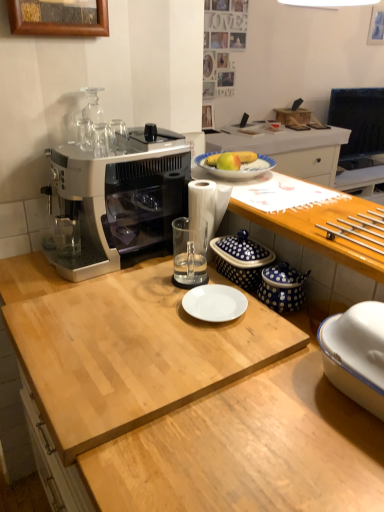
The height and width of the screenshot is (512, 384). What do you see at coordinates (58, 18) in the screenshot? I see `wooden picture frame at upper left` at bounding box center [58, 18].

Image resolution: width=384 pixels, height=512 pixels. What do you see at coordinates (241, 259) in the screenshot?
I see `blue polka dot ceramic container at center, arranged as the 2th appliance when viewed from the front` at bounding box center [241, 259].

What is the approximate width of satin silver coffee maker at left?

satin silver coffee maker at left is 18.54 inches in width.

I want to click on satin silver coffee maker at left, so click(118, 200).

Locate an element on the screen. This screenshot has width=384, height=512. wooden picture frame at upper left is located at coordinates (58, 18).

Between blue polka dot ceramic container at center, arranged as the 2th appliance when viewed from the front, and blue dotted ceramic jars at right, positioned as the 2th appliance in back-to-front order, which one has smaller size?

Smaller between the two is blue dotted ceramic jars at right, positioned as the 2th appliance in back-to-front order.

Who is taller, blue polka dot ceramic container at center, positioned as the first appliance in back-to-front order, or blue dotted ceramic jars at right, positioned as the 2th appliance in back-to-front order?

Standing taller between the two is blue polka dot ceramic container at center, positioned as the first appliance in back-to-front order.

Is blue polka dot ceramic container at center, arranged as the 2th appliance when viewed from the front, looking in the opposite direction of blue dotted ceramic jars at right, which appears as the first appliance when viewed from the front?

blue polka dot ceramic container at center, arranged as the 2th appliance when viewed from the front, is not turned away from blue dotted ceramic jars at right, which appears as the first appliance when viewed from the front.

Is blue polka dot ceramic container at center, arranged as the 2th appliance when viewed from the front, to the right of blue dotted ceramic jars at right, positioned as the 2th appliance in back-to-front order, from the viewer's perspective?

No, blue polka dot ceramic container at center, arranged as the 2th appliance when viewed from the front, is not to the right of blue dotted ceramic jars at right, positioned as the 2th appliance in back-to-front order.

Considering the sizes of objects light wood cutting board at center, which ranks as the second desk in top-to-bottom order, and satin silver coffee maker at left in the image provided, who is wider, light wood cutting board at center, which ranks as the second desk in top-to-bottom order, or satin silver coffee maker at left?

With larger width is light wood cutting board at center, which ranks as the second desk in top-to-bottom order.

From the image's perspective, is light wood cutting board at center, which is counted as the first desk, starting from the bottom, under satin silver coffee maker at left?

Yes.

From a real-world perspective, is light wood cutting board at center, which ranks as the second desk in top-to-bottom order, located higher than satin silver coffee maker at left?

Actually, light wood cutting board at center, which ranks as the second desk in top-to-bottom order, is physically below satin silver coffee maker at left in the real world.

Is the depth of light wood cutting board at center, which ranks as the second desk in top-to-bottom order, less than that of satin silver coffee maker at left?

That is True.

From a real-world perspective, is wooden picture frame at upper left over wooden at upper right, the 2th desk in the bottom-to-top sequence?

Yes, from a real-world perspective, wooden picture frame at upper left is on top of wooden at upper right, the 2th desk in the bottom-to-top sequence.

From the image's perspective, relative to wooden at upper right, the 2th desk in the bottom-to-top sequence, is wooden picture frame at upper left above or below?

wooden picture frame at upper left is situated higher than wooden at upper right, the 2th desk in the bottom-to-top sequence, in the image.

You are a GUI agent. You are given a task and a screenshot of the screen. Output one action in this format:
    pyautogui.click(x=<x>, y=<y>)
    Task: Click on the picture frame located above the wooden at upper right, the 2th desk in the bottom-to-top sequence (from a real-world perspective)
    Image resolution: width=384 pixels, height=512 pixels.
    Given the screenshot: What is the action you would take?
    pyautogui.click(x=58, y=18)

Based on the photo, is wooden picture frame at upper left positioned behind wooden at upper right, acting as the first desk starting from the top?

Yes.

Considering the sizes of objects satin silver coffee maker at left and blue polka dot ceramic container at center, arranged as the 2th appliance when viewed from the front, in the image provided, who is taller, satin silver coffee maker at left or blue polka dot ceramic container at center, arranged as the 2th appliance when viewed from the front,?

With more height is satin silver coffee maker at left.

Considering the relative positions of satin silver coffee maker at left and blue polka dot ceramic container at center, arranged as the 2th appliance when viewed from the front, in the image provided, is satin silver coffee maker at left in front of blue polka dot ceramic container at center, arranged as the 2th appliance when viewed from the front,?

Yes, it is in front of blue polka dot ceramic container at center, arranged as the 2th appliance when viewed from the front.

Would you say satin silver coffee maker at left is a long distance from blue polka dot ceramic container at center, arranged as the 2th appliance when viewed from the front?

satin silver coffee maker at left is near blue polka dot ceramic container at center, arranged as the 2th appliance when viewed from the front, not far away.

Does blue dotted ceramic jars at right, positioned as the 2th appliance in back-to-front order, have a larger size compared to blue polka dot ceramic container at center, arranged as the 2th appliance when viewed from the front?

No, blue dotted ceramic jars at right, positioned as the 2th appliance in back-to-front order, is not bigger than blue polka dot ceramic container at center, arranged as the 2th appliance when viewed from the front.

Identify the location of appliance lying on the right of blue polka dot ceramic container at center, arranged as the 2th appliance when viewed from the front. (282, 287).

Is point (267, 293) closer or farther from the camera than point (230, 260)?

Point (267, 293) is closer to the camera than point (230, 260).

Which is correct: blue dotted ceramic jars at right, positioned as the 2th appliance in back-to-front order, is inside blue polka dot ceramic container at center, positioned as the first appliance in back-to-front order, or outside of it?

blue dotted ceramic jars at right, positioned as the 2th appliance in back-to-front order, exists outside the volume of blue polka dot ceramic container at center, positioned as the first appliance in back-to-front order.

Choose the correct answer: Is blue polka dot ceramic container at center, positioned as the first appliance in back-to-front order, inside black glossy television at upper right or outside it?

The correct answer is: outside.

Considering the sizes of objects blue polka dot ceramic container at center, arranged as the 2th appliance when viewed from the front, and black glossy television at upper right in the image provided, who is smaller, blue polka dot ceramic container at center, arranged as the 2th appliance when viewed from the front, or black glossy television at upper right?

Smaller between the two is blue polka dot ceramic container at center, arranged as the 2th appliance when viewed from the front.

From the image's perspective, is blue polka dot ceramic container at center, positioned as the first appliance in back-to-front order, under black glossy television at upper right?

Yes, from the image's perspective, blue polka dot ceramic container at center, positioned as the first appliance in back-to-front order, is below black glossy television at upper right.

Considering the relative sizes of blue polka dot ceramic container at center, arranged as the 2th appliance when viewed from the front, and black glossy television at upper right in the image provided, is blue polka dot ceramic container at center, arranged as the 2th appliance when viewed from the front, taller than black glossy television at upper right?

No, blue polka dot ceramic container at center, arranged as the 2th appliance when viewed from the front, is not taller than black glossy television at upper right.

Consider the image. From a real-world perspective, who is located lower, transparent glass at center, the first tableware in the bottom-to-top sequence, or metallic silver drawer handles at right, the 2th tableware when ordered from top to bottom?

transparent glass at center, the first tableware in the bottom-to-top sequence, is physically lower.

Considering the positions of objects transparent glass at center, the 2th tableware positioned from the left, and metallic silver drawer handles at right, positioned as the third tableware in left-to-right order, in the image provided, who is more to the left, transparent glass at center, the 2th tableware positioned from the left, or metallic silver drawer handles at right, positioned as the third tableware in left-to-right order,?

Positioned to the left is transparent glass at center, the 2th tableware positioned from the left.

How different are the orientations of transparent glass at center, the 2th tableware positioned from the left, and metallic silver drawer handles at right, positioned as the third tableware in left-to-right order, in degrees?

0.486 degrees.

Are transparent glass at center, the 2th tableware positioned from the left, and metallic silver drawer handles at right, the 1th tableware in the right-to-left sequence, beside each other?

transparent glass at center, the 2th tableware positioned from the left, and metallic silver drawer handles at right, the 1th tableware in the right-to-left sequence, are not in contact.

Find the location of a particular element. appliance behind the blue dotted ceramic jars at right, which appears as the first appliance when viewed from the front is located at coordinates (241, 259).

At what (x,y) coordinates should I click in order to perform the action: click on the 2nd desk below the satin silver coffee maker at left (from the image's perspective). Please return your answer as a coordinate pair (x, y). The width and height of the screenshot is (384, 512). Looking at the image, I should click on (249, 448).

Looking at the image, which one is located further to wooden at upper right, acting as the first desk starting from the top, light wood cutting board at center, which is counted as the first desk, starting from the bottom, or yellow matte apple at center?

light wood cutting board at center, which is counted as the first desk, starting from the bottom, lies further to wooden at upper right, acting as the first desk starting from the top, than the other object.

Considering their positions, is satin silver coffee maker at left positioned further to light wood cutting board at center, which ranks as the second desk in top-to-bottom order, than blue dotted ceramic jars at right, which appears as the first appliance when viewed from the front?

satin silver coffee maker at left lies further to light wood cutting board at center, which ranks as the second desk in top-to-bottom order, than the other object.

Based on the photo, estimate the real-world distances between objects in this image. Which object is further from satin silver coffee maker at left, wooden picture frame at upper left or clear glass cups at upper left, acting as the third tableware starting from the right?

wooden picture frame at upper left is positioned further to the anchor satin silver coffee maker at left.

Considering their positions, is yellow matte apple at center positioned closer to metallic silver drawer handles at right, positioned as the third tableware in left-to-right order, than wooden picture frame at upper left?

yellow matte apple at center lies closer to metallic silver drawer handles at right, positioned as the third tableware in left-to-right order, than the other object.

Considering their positions, is metallic silver drawer handles at right, which appears as the second tableware when ordered from the bottom, positioned further to blue dotted ceramic jars at right, positioned as the 2th appliance in back-to-front order, than light wood cutting board at center, which ranks as the second desk in top-to-bottom order?

light wood cutting board at center, which ranks as the second desk in top-to-bottom order, is further to blue dotted ceramic jars at right, positioned as the 2th appliance in back-to-front order.

Looking at the image, which one is located closer to transparent glass at center, placed as the third tableware when sorted from top to bottom, wooden picture frame at upper left or black glossy television at upper right?

wooden picture frame at upper left is positioned closer to the anchor transparent glass at center, placed as the third tableware when sorted from top to bottom.

Looking at the image, which one is located closer to clear glass cups at upper left, the 1th tableware positioned from the top, wooden at upper right, the 2th desk in the bottom-to-top sequence, or black glossy television at upper right?

Among the two, wooden at upper right, the 2th desk in the bottom-to-top sequence, is located nearer to clear glass cups at upper left, the 1th tableware positioned from the top.

Looking at the image, which one is located closer to blue dotted ceramic jars at right, positioned as the 2th appliance in back-to-front order, wooden picture frame at upper left or metallic silver drawer handles at right, which appears as the second tableware when ordered from the bottom?

metallic silver drawer handles at right, which appears as the second tableware when ordered from the bottom, is closer to blue dotted ceramic jars at right, positioned as the 2th appliance in back-to-front order.

Locate an element on the screen. coffee maker that lies between wooden picture frame at upper left and transparent glass at center, the 2th tableware positioned from the left, from top to bottom is located at coordinates (118, 200).

Image resolution: width=384 pixels, height=512 pixels. What are the coordinates of `apple situated between clear glass cups at upper left, which is counted as the first tableware, starting from the left, and blue polka dot ceramic container at center, positioned as the first appliance in back-to-front order, from left to right` in the screenshot? It's located at (228, 161).

Identify the location of tableware between wooden picture frame at upper left and blue polka dot ceramic container at center, positioned as the first appliance in back-to-front order, vertically. (117, 135).

At what (x,y) coordinates should I click in order to perform the action: click on coffee maker between wooden at upper right, the 2th desk in the bottom-to-top sequence, and black glossy television at upper right in the front-back direction. Please return your answer as a coordinate pair (x, y). Looking at the image, I should click on (118, 200).